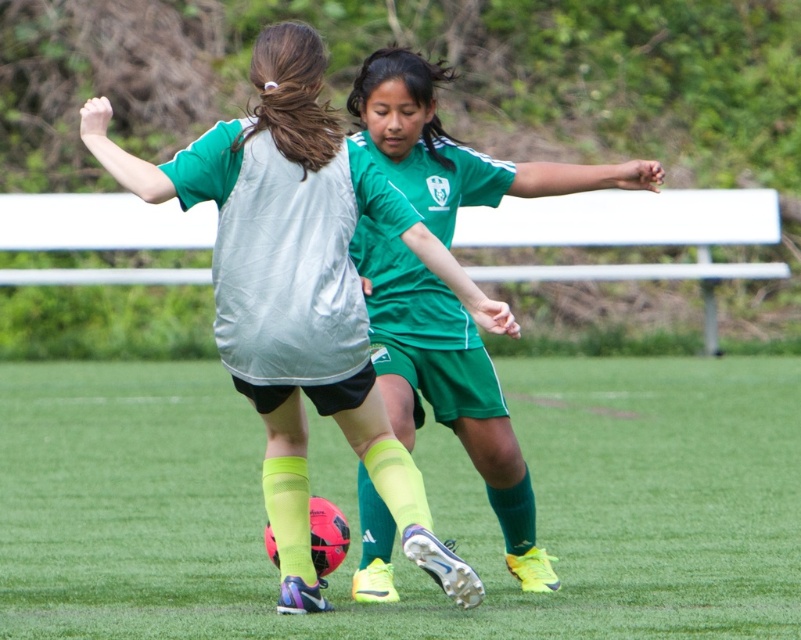
Question: Estimate the real-world distances between objects in this image. Which object is farther from the rubber soccer ball at center?

Choices:
 (A) matte green jersey at center
 (B) green matte jersey at center

Answer: (B)

Question: Where is matte green jersey at center located in relation to green matte jersey at center in the image?

Choices:
 (A) left
 (B) right

Answer: (A)

Question: From the image, what is the correct spatial relationship of rubber soccer ball at center in relation to green matte jersey at center?

Choices:
 (A) right
 (B) left

Answer: (B)

Question: Which of the following is the closest to the observer?

Choices:
 (A) (312, 342)
 (B) (533, 477)

Answer: (A)

Question: Is matte green jersey at center positioned before green matte jersey at center?

Choices:
 (A) no
 (B) yes

Answer: (B)

Question: Which of the following is the farthest from the observer?

Choices:
 (A) rubber soccer ball at center
 (B) matte green jersey at center
 (C) green matte jersey at center

Answer: (C)